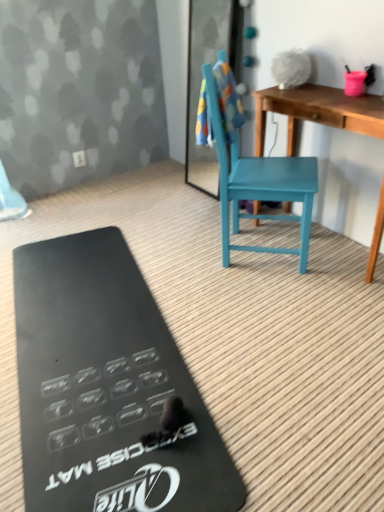
Question: From their relative heights in the image, would you say white plastic power outlet at upper center is taller or shorter than teal wood chair at center?

Choices:
 (A) tall
 (B) short

Answer: (B)

Question: Is white plastic power outlet at upper center wider or thinner than teal wood chair at center?

Choices:
 (A) wide
 (B) thin

Answer: (B)

Question: Considering the real-world distances, which object is closest to the wooden desk at center?

Choices:
 (A) teal wood chair at center
 (B) white plastic power outlet at upper center
 (C) black rubber exercise mat at lower left
 (D) multicolored fabric towel at upper center

Answer: (A)

Question: Estimate the real-world distances between objects in this image. Which object is closer to the black rubber exercise mat at lower left?

Choices:
 (A) teal wood chair at center
 (B) wooden desk at center
 (C) white plastic power outlet at upper center
 (D) multicolored fabric towel at upper center

Answer: (A)